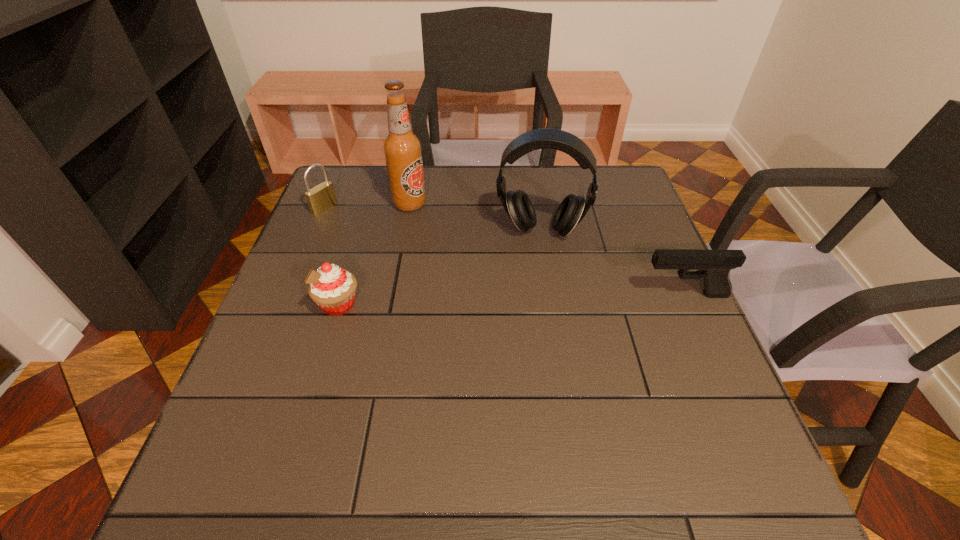
Where is `vacant space located on the front-facing side of the pistol`? vacant space located on the front-facing side of the pistol is located at coordinates (613, 295).

You are a GUI agent. You are given a task and a screenshot of the screen. Output one action in this format:
    pyautogui.click(x=<x>, y=<y>)
    Task: Click on the vacant region located on the front label of the tallest object
    This screenshot has height=540, width=960.
    Given the screenshot: What is the action you would take?
    pyautogui.click(x=432, y=220)

At what (x,y) coordinates should I click in order to perform the action: click on blank space located on the front label of the tallest object. Please return your answer as a coordinate pair (x, y). Looking at the image, I should click on (437, 223).

The height and width of the screenshot is (540, 960). In order to click on vacant space located on the front label of the tallest object in this screenshot , I will do `click(488, 259)`.

At what (x,y) coordinates should I click in order to perform the action: click on free location located on the ear cups of the earphone. Please return your answer as a coordinate pair (x, y). The width and height of the screenshot is (960, 540). Looking at the image, I should click on (535, 259).

Identify the location of vacant region located on the ear cups of the earphone. The height and width of the screenshot is (540, 960). (527, 342).

This screenshot has width=960, height=540. Find the location of `free space located 0.190m on the ear cups of the earphone`. free space located 0.190m on the ear cups of the earphone is located at coordinates (531, 300).

At what (x,y) coordinates should I click in order to perform the action: click on vacant region located 0.330m on the front-facing side of the leftmost object. Please return your answer as a coordinate pair (x, y). This screenshot has height=540, width=960. Looking at the image, I should click on (419, 261).

Identify the location of vacant space located 0.270m on the front-facing side of the leftmost object. (401, 251).

Where is `vacant space located on the front-facing side of the leftmost object`? vacant space located on the front-facing side of the leftmost object is located at coordinates (346, 221).